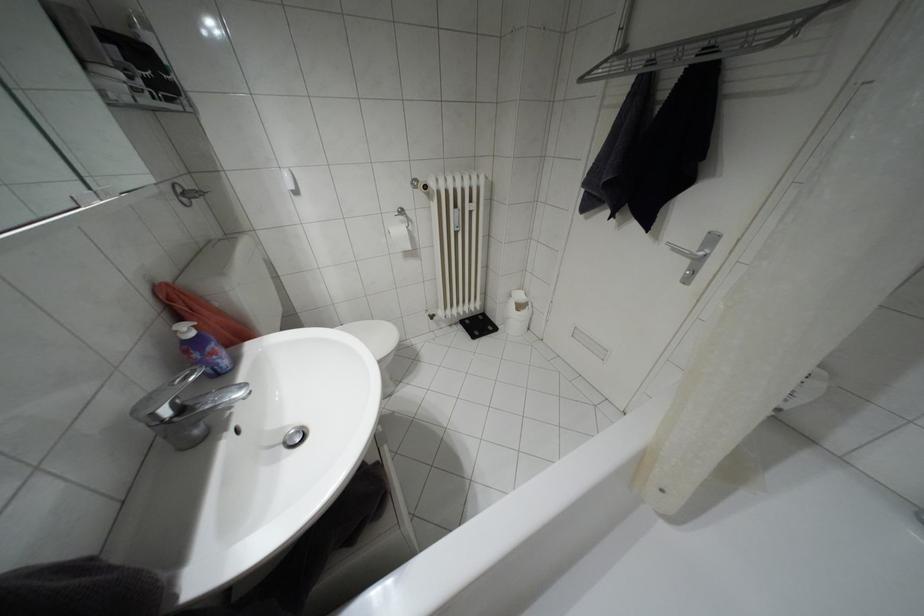
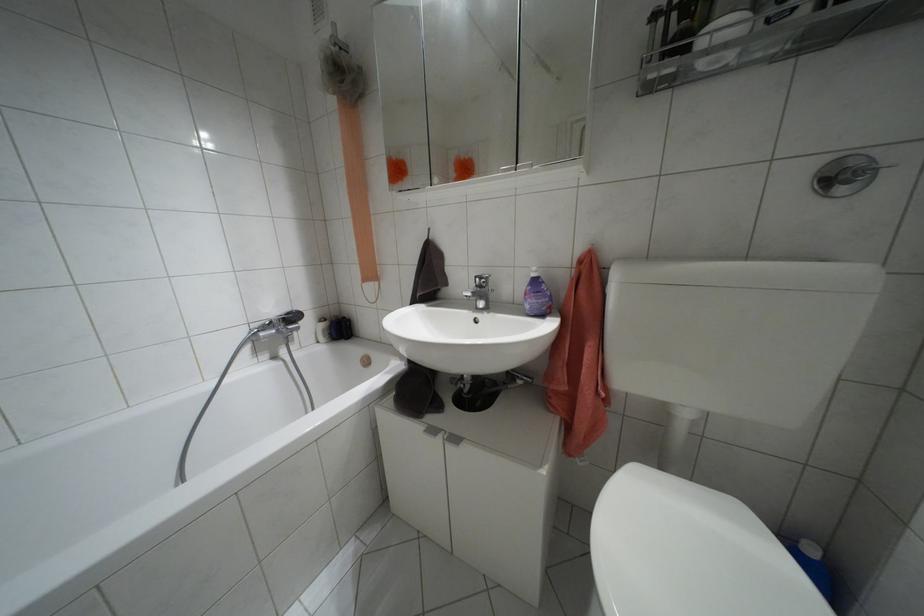
Find the pixel in the second image that matches the point at 190,333 in the first image.

(532, 274)